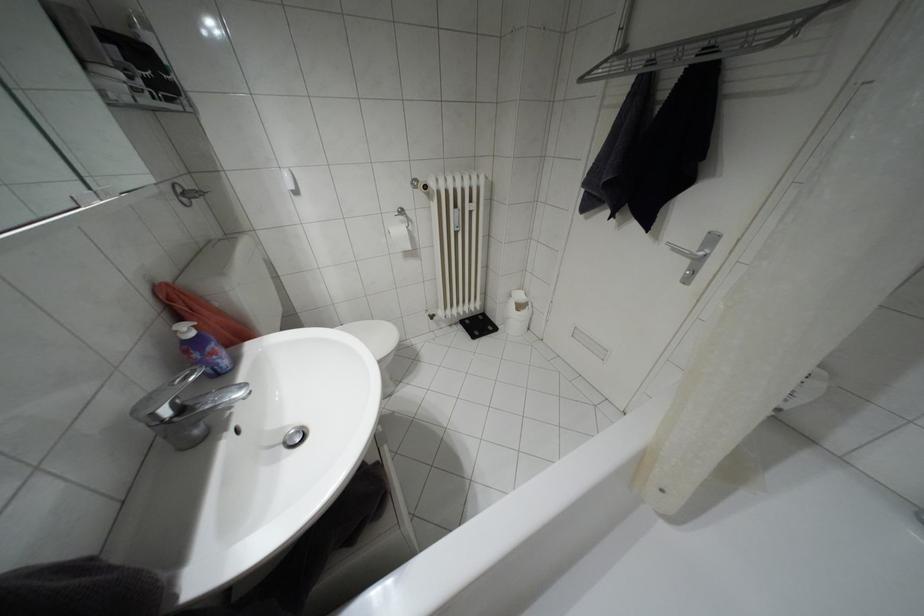
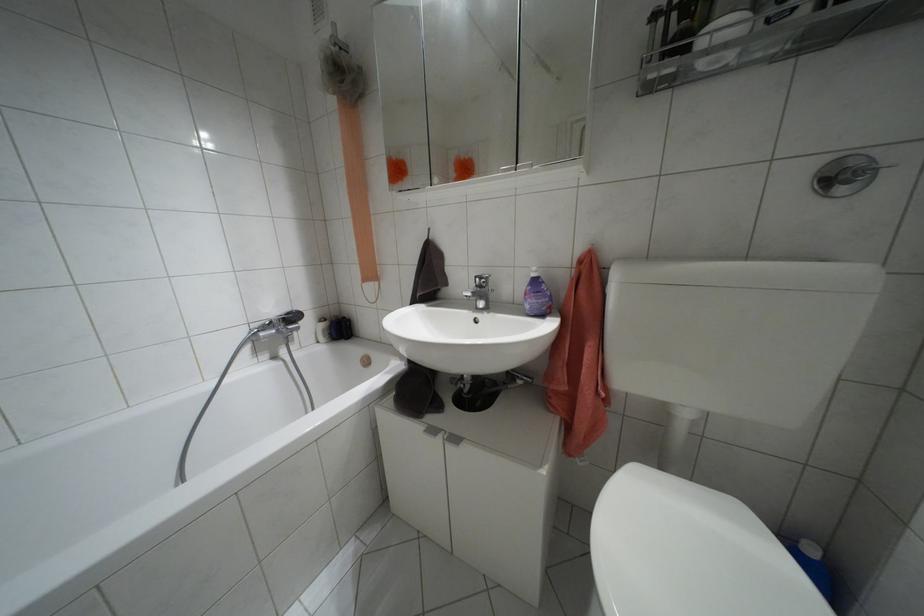
Find the pixel in the second image that matches the point at 190,333 in the first image.

(532, 274)